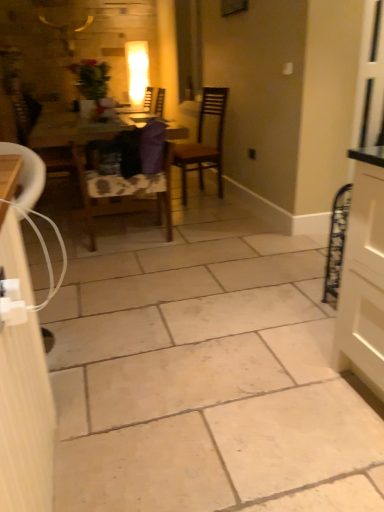
Locate an element on the screen. The image size is (384, 512). vacant space in white glossy cabinet at left (from a real-world perspective) is located at coordinates (57, 336).